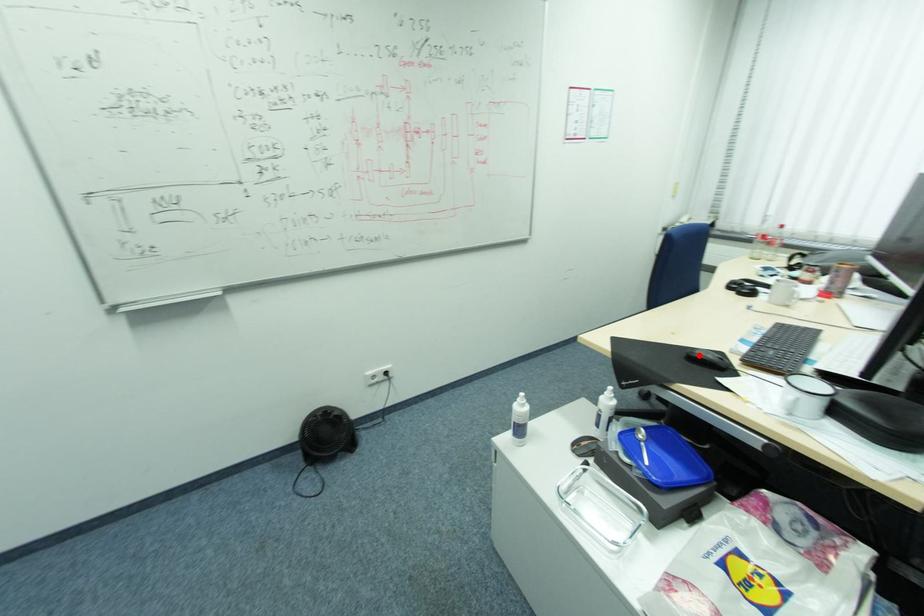
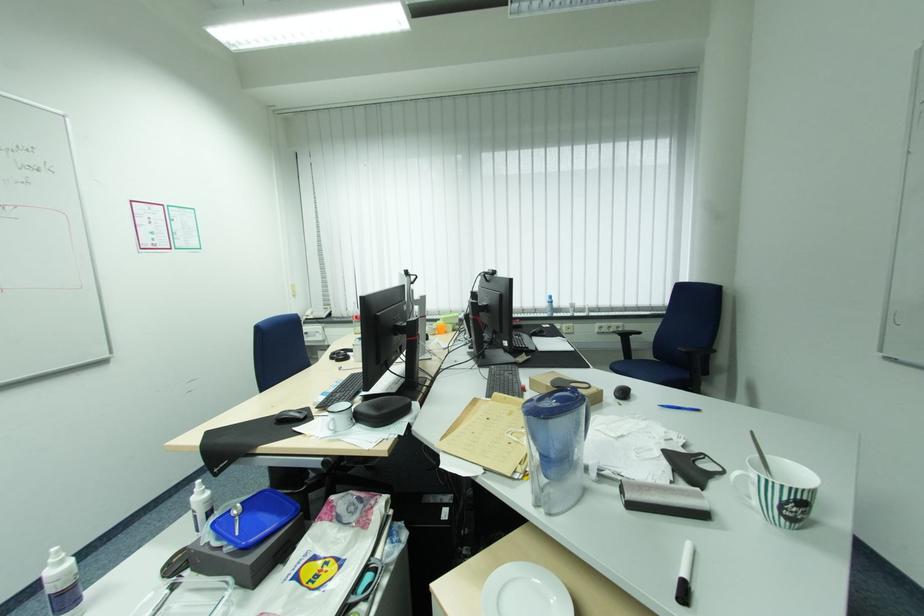
The point at the highlighted location is marked in the first image. Where is the corresponding point in the second image?

(286, 418)